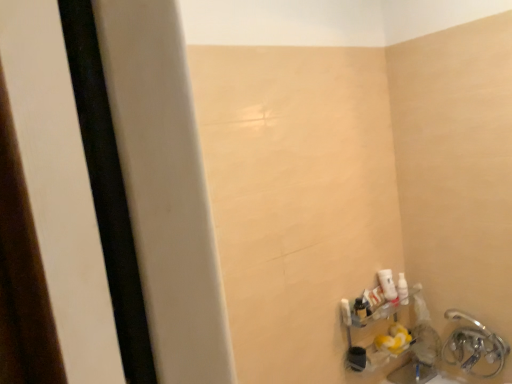
Question: Is white glossy lotion at lower right in front of or behind silver metallic faucet at lower right in the image?

Choices:
 (A) behind
 (B) front

Answer: (A)

Question: From the image's perspective, is white glossy lotion at lower right above or below silver metallic faucet at lower right?

Choices:
 (A) below
 (B) above

Answer: (B)

Question: From a real-world perspective, is white glossy lotion at lower right positioned above or below silver metallic faucet at lower right?

Choices:
 (A) below
 (B) above

Answer: (B)

Question: Does point (467, 316) appear closer or farther from the camera than point (388, 289)?

Choices:
 (A) closer
 (B) farther

Answer: (A)

Question: From a real-world perspective, is silver metallic faucet at lower right physically located above or below white glossy lotion at lower right?

Choices:
 (A) above
 (B) below

Answer: (B)

Question: Considering the positions of silver metallic faucet at lower right and white glossy lotion at lower right in the image, is silver metallic faucet at lower right wider or thinner than white glossy lotion at lower right?

Choices:
 (A) wide
 (B) thin

Answer: (A)

Question: Is silver metallic faucet at lower right inside or outside of white glossy lotion at lower right?

Choices:
 (A) inside
 (B) outside

Answer: (B)